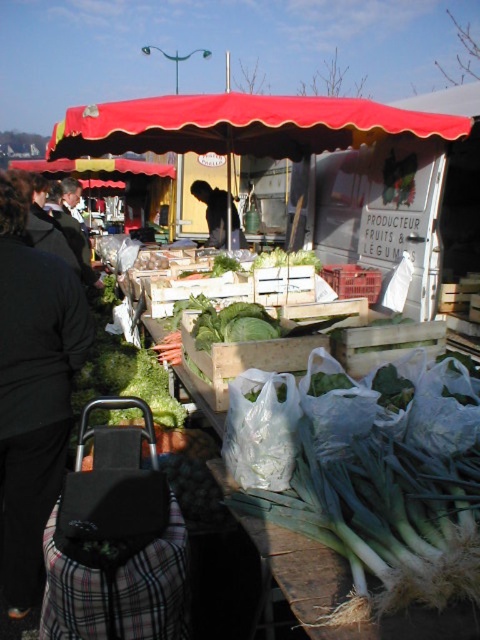
Question: Is black fabric bag at lower left to the right of green leafy at center from the viewer's perspective?

Choices:
 (A) yes
 (B) no

Answer: (B)

Question: Which of the following is the farthest from the observer?

Choices:
 (A) (55, 492)
 (B) (207, 240)

Answer: (B)

Question: Which of the following is the closest to the observer?

Choices:
 (A) (x=214, y=230)
 (B) (x=72, y=323)
 (C) (x=164, y=125)
 (D) (x=208, y=342)

Answer: (B)

Question: Among these points, which one is farthest from the camera?

Choices:
 (A) (207, 228)
 (B) (275, 131)
 (C) (13, 205)

Answer: (A)

Question: Does black fabric bag at lower left appear on the right side of red fabric canopy at upper center?

Choices:
 (A) yes
 (B) no

Answer: (B)

Question: In this image, where is red fabric canopy at upper center located relative to black fabric at center?

Choices:
 (A) below
 (B) above

Answer: (B)